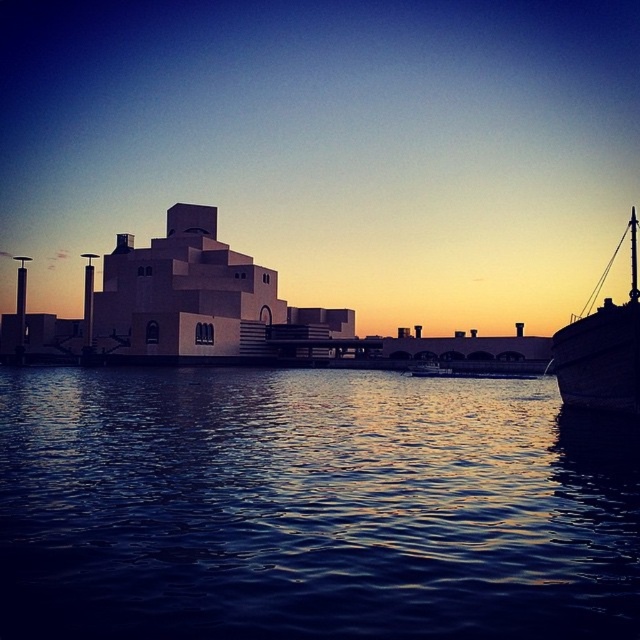
Question: Which object is farther from the camera taking this photo?

Choices:
 (A) dark blue liquid at center
 (B) wooden ship at right

Answer: (B)

Question: Is dark blue liquid at center further to camera compared to wooden ship at right?

Choices:
 (A) yes
 (B) no

Answer: (B)

Question: Does dark blue liquid at center appear over wooden ship at right?

Choices:
 (A) yes
 (B) no

Answer: (B)

Question: Among these objects, which one is farthest from the camera?

Choices:
 (A) dark blue liquid at center
 (B) wooden ship at right

Answer: (B)

Question: Can you confirm if dark blue liquid at center is positioned to the left of wooden ship at right?

Choices:
 (A) yes
 (B) no

Answer: (A)